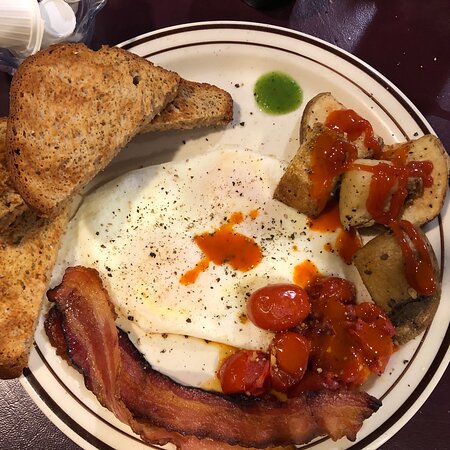
You are a GUI agent. You are given a task and a screenshot of the screen. Output one action in this format:
    pyautogui.click(x=<x>, y=<y>)
    Task: Click on the dinner plate
    
    Given the screenshot: What is the action you would take?
    pyautogui.click(x=81, y=422), pyautogui.click(x=215, y=48), pyautogui.click(x=399, y=393)